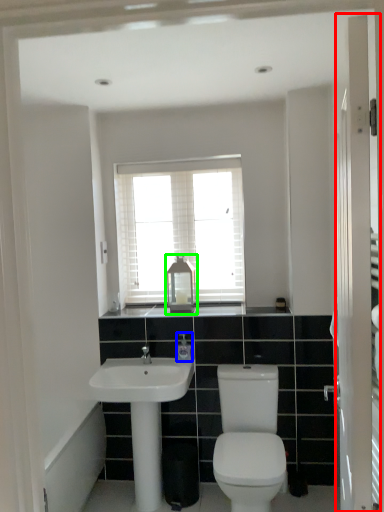
Question: Which object is positioned closest to screen door (highlighted by a red box)? Select from toiletry (highlighted by a blue box) and medicine cabinet (highlighted by a green box).

Choices:
 (A) toiletry
 (B) medicine cabinet

Answer: (A)